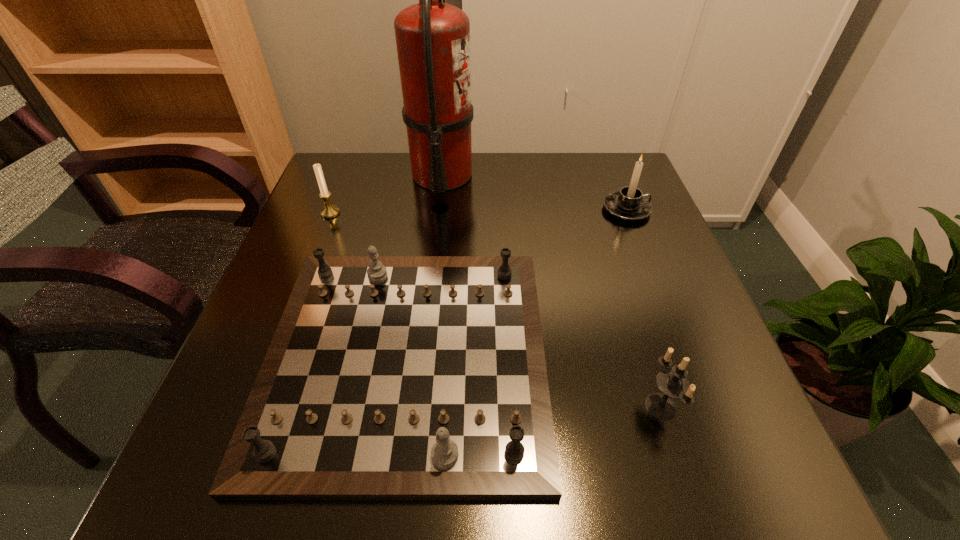
Locate an element on the screen. This screenshot has height=540, width=960. candle holder situated at the left edge is located at coordinates (328, 211).

Identify the location of chessboard situated at the left edge. (388, 377).

This screenshot has height=540, width=960. Identify the location of object at the near left corner. (388, 377).

This screenshot has height=540, width=960. I want to click on object that is at the far right corner, so click(630, 204).

The width and height of the screenshot is (960, 540). In the image, there is a desktop. In order to click on free region at the far edge in this screenshot , I will do `click(516, 166)`.

In order to click on free space at the near edge of the desktop in this screenshot , I will do `click(615, 471)`.

The image size is (960, 540). In the image, there is a desktop. Find the location of `free space at the left edge`. free space at the left edge is located at coordinates (307, 228).

In the image, there is a desktop. Identify the location of vacant area at the right edge. The width and height of the screenshot is (960, 540). (692, 383).

Locate an element on the screen. The width and height of the screenshot is (960, 540). vacant space at the far left corner is located at coordinates (357, 187).

The width and height of the screenshot is (960, 540). I want to click on vacant region at the near right corner of the desktop, so click(673, 467).